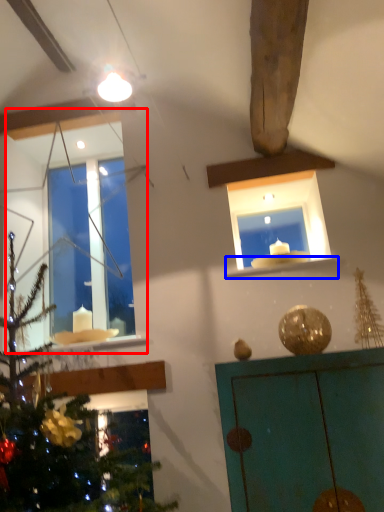
Question: Which object appears closest to the camera in this image, window (highlighted by a red box) or window sill (highlighted by a blue box)?

Choices:
 (A) window
 (B) window sill

Answer: (B)